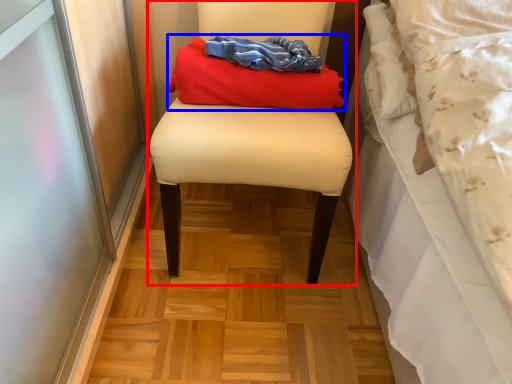
Question: Which of the following is the closest to the observer, furniture (highlighted by a red box) or laundry (highlighted by a blue box)?

Choices:
 (A) furniture
 (B) laundry

Answer: (A)